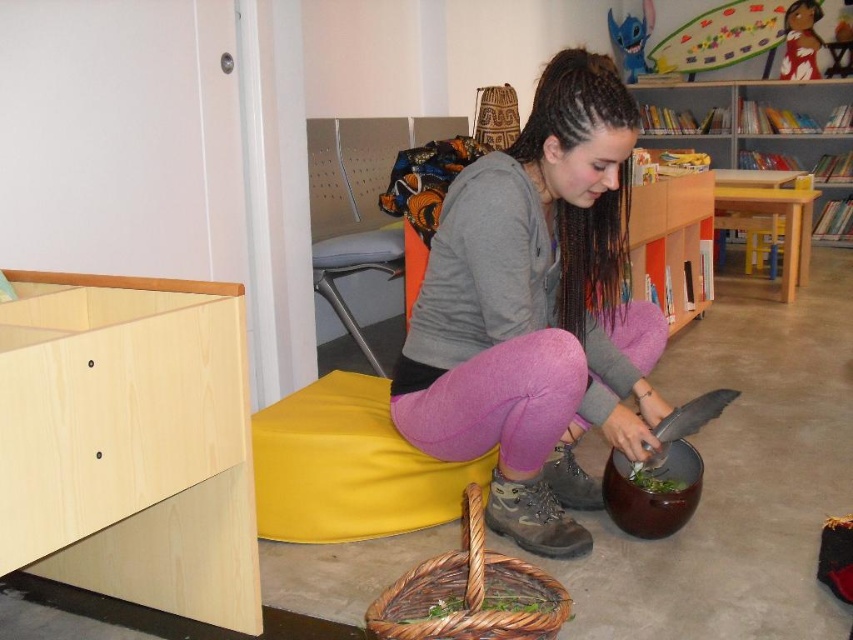
You are a tailor who needs to determine which clothing item requires more fabric to repair between the matte gray hoodie at center and the brown leather shoe at lower center. Which one would you choose?

The matte gray hoodie at center is larger in size than the brown leather shoe at lower center, so it would require more fabric to repair.

You are standing in a child room and want to reach a point that is 4.02 feet away from the camera. The coordinates of this point are given as point (378, 605). Can you estimate whether this point is within your arm reach? Assume your arm length is 2.5 feet.

The point (378, 605) is 4.02 feet away from the camera, which is farther than your arm length of 2.5 feet. Therefore, you cannot reach it with your arm.

You are organizing a playroom and need to place the woven brown basket at lower center and the blue plush toy at upper center on a shelf. Which object requires more shelf space?

The blue plush toy at upper center requires more shelf space because the woven brown basket at lower center occupies less space than it.